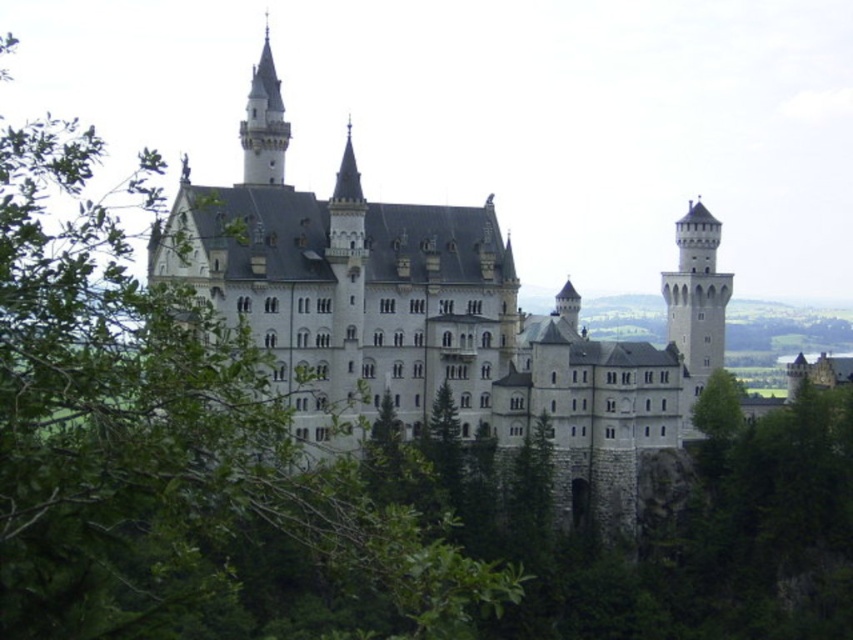
Consider the image. Is white stone castle at center to the left of white stone tower at right from the viewer's perspective?

Indeed, white stone castle at center is positioned on the left side of white stone tower at right.

Is white stone castle at center smaller than white stone tower at right?

Actually, white stone castle at center might be larger than white stone tower at right.

Which is behind, point (283, 275) or point (692, 381)?

Positioned behind is point (692, 381).

This screenshot has width=853, height=640. What are the coordinates of `white stone castle at center` in the screenshot? It's located at (425, 330).

Is point (712, 273) more distant than point (281, 150)?

That is True.

Can you confirm if white stone tower at right is taller than stone spire at upper left?

Yes, white stone tower at right is taller than stone spire at upper left.

Find the location of a particular element. white stone tower at right is located at coordinates (695, 294).

At what (x,y) coordinates should I click in order to perform the action: click on white stone tower at right. Please return your answer as a coordinate pair (x, y). Looking at the image, I should click on (695, 294).

Does green leafy tree at left appear under white stone tower at right?

Yes, green leafy tree at left is below white stone tower at right.

Is green leafy tree at left positioned in front of white stone tower at right?

Yes, it is in front of white stone tower at right.

This screenshot has height=640, width=853. Describe the element at coordinates (165, 444) in the screenshot. I see `green leafy tree at left` at that location.

You are a GUI agent. You are given a task and a screenshot of the screen. Output one action in this format:
    pyautogui.click(x=<x>, y=<y>)
    Task: Click on the green leafy tree at left
    The width and height of the screenshot is (853, 640).
    Given the screenshot: What is the action you would take?
    pyautogui.click(x=165, y=444)